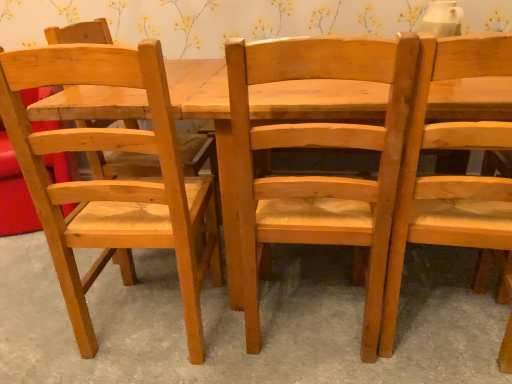
You are a GUI agent. You are given a task and a screenshot of the screen. Output one action in this format:
    pyautogui.click(x=<x>, y=<y>)
    Task: Click on the blank area beneath natural wood chair at left, placed as the first chair when sorted from left to right (from a real-world perspective)
    Image resolution: width=512 pixels, height=384 pixels.
    Given the screenshot: What is the action you would take?
    pyautogui.click(x=144, y=320)